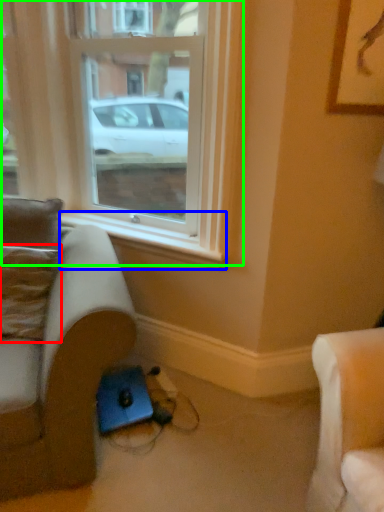
Question: Which object is positioned closest to pillow (highlighted by a red box)? Select from window sill (highlighted by a blue box) and window (highlighted by a green box).

Choices:
 (A) window sill
 (B) window

Answer: (A)